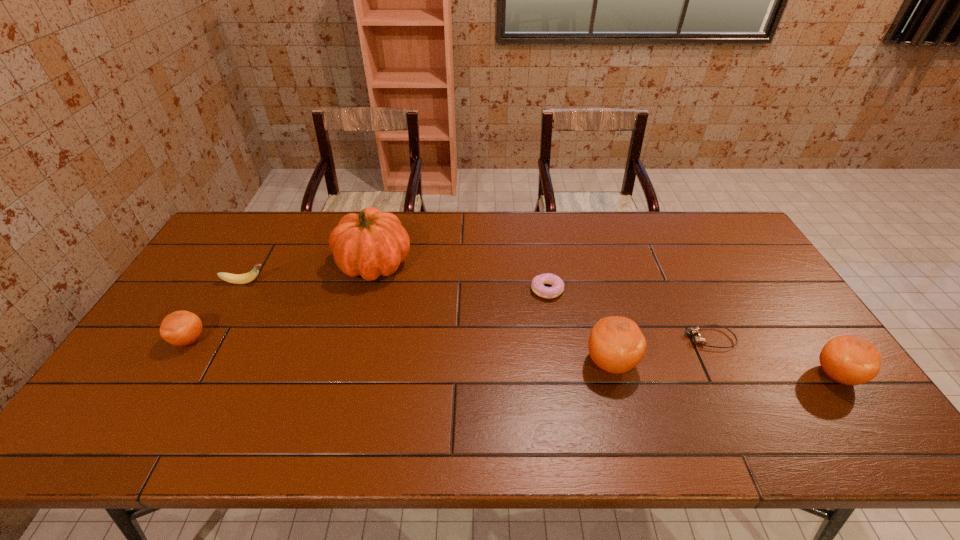
This screenshot has width=960, height=540. In order to click on the second object from right to left in this screenshot , I will do `click(699, 339)`.

I want to click on the shortest object, so click(699, 339).

Identify the location of banana. Image resolution: width=960 pixels, height=540 pixels. (245, 278).

Find the location of a particular element. Image resolution: width=960 pixels, height=540 pixels. vacant space located on the back of the fourth tallest object is located at coordinates (229, 274).

The width and height of the screenshot is (960, 540). What are the coordinates of `vacant space situated 0.350m on the back of the third object from right to left` in the screenshot? It's located at (584, 258).

What are the coordinates of `vacant space located on the back of the second tallest orange` in the screenshot? It's located at (771, 281).

Where is `free location located 0.350m on the back of the doughnut`? This screenshot has width=960, height=540. free location located 0.350m on the back of the doughnut is located at coordinates (535, 214).

The width and height of the screenshot is (960, 540). I want to click on vacant space located 0.350m on the right of the pumpkin, so click(x=520, y=264).

Where is `vacant space located on the front lenses and sides of the shortest object`? The height and width of the screenshot is (540, 960). vacant space located on the front lenses and sides of the shortest object is located at coordinates (601, 339).

The image size is (960, 540). What are the coordinates of `vacant area located 0.140m on the front lenses and sides of the shortest object` in the screenshot? It's located at (634, 339).